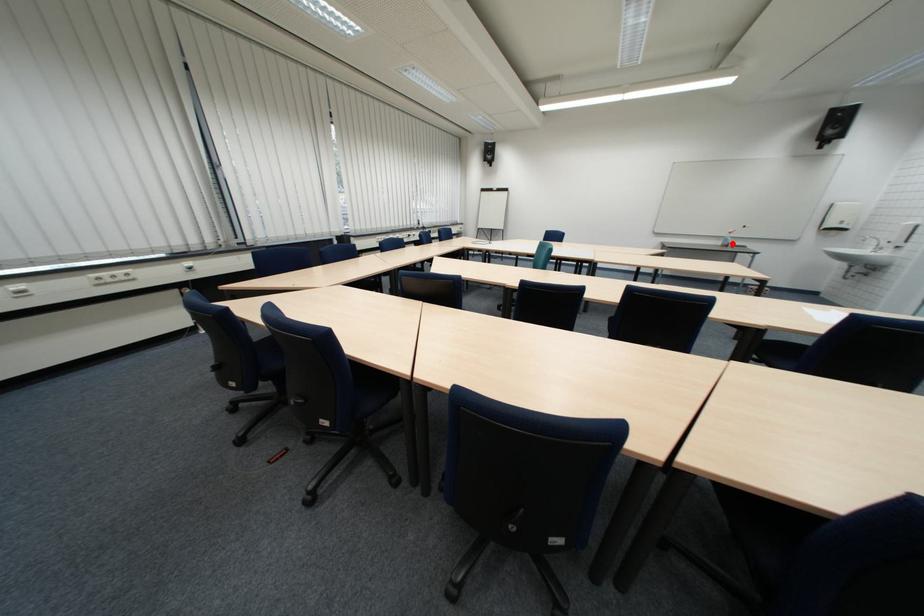
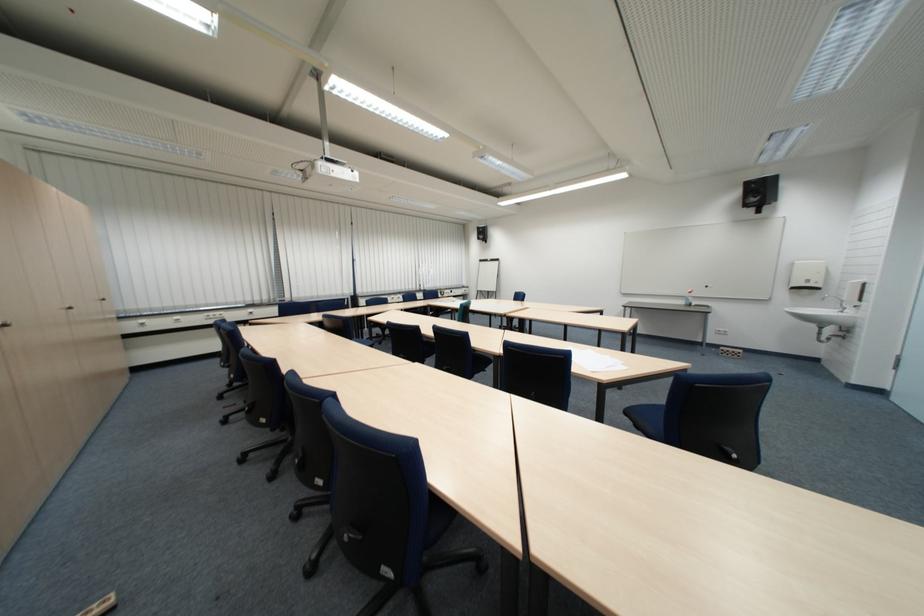
Locate, in the second image, the point that corresponds to the highlighted location in the first image.

(696, 302)